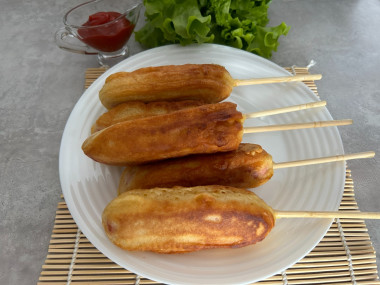
Locate an element on the screen. The image size is (380, 285). ridges on plate is located at coordinates (82, 186).